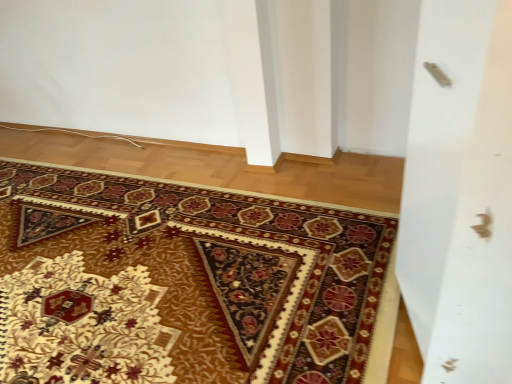
Question: Is carpet with intricate patterns at center taller than silver metallic screen door at upper right?

Choices:
 (A) no
 (B) yes

Answer: (A)

Question: Is carpet with intricate patterns at center to the right of silver metallic screen door at upper right from the viewer's perspective?

Choices:
 (A) yes
 (B) no

Answer: (B)

Question: Is the depth of carpet with intricate patterns at center greater than that of silver metallic screen door at upper right?

Choices:
 (A) yes
 (B) no

Answer: (A)

Question: From the image's perspective, is carpet with intricate patterns at center over silver metallic screen door at upper right?

Choices:
 (A) no
 (B) yes

Answer: (A)

Question: Is carpet with intricate patterns at center bigger than silver metallic screen door at upper right?

Choices:
 (A) no
 (B) yes

Answer: (A)

Question: Is silver metallic screen door at upper right surrounded by carpet with intricate patterns at center?

Choices:
 (A) yes
 (B) no

Answer: (B)

Question: Is silver metallic screen door at upper right outside of carpet with intricate patterns at center?

Choices:
 (A) no
 (B) yes

Answer: (B)

Question: Is silver metallic screen door at upper right shorter than carpet with intricate patterns at center?

Choices:
 (A) no
 (B) yes

Answer: (A)

Question: Is the position of silver metallic screen door at upper right more distant than that of carpet with intricate patterns at center?

Choices:
 (A) yes
 (B) no

Answer: (B)

Question: Considering the relative sizes of silver metallic screen door at upper right and carpet with intricate patterns at center in the image provided, is silver metallic screen door at upper right thinner than carpet with intricate patterns at center?

Choices:
 (A) no
 (B) yes

Answer: (B)

Question: From a real-world perspective, is silver metallic screen door at upper right below carpet with intricate patterns at center?

Choices:
 (A) no
 (B) yes

Answer: (A)

Question: Is silver metallic screen door at upper right oriented towards carpet with intricate patterns at center?

Choices:
 (A) no
 (B) yes

Answer: (B)

Question: Is carpet with intricate patterns at center taller or shorter than silver metallic screen door at upper right?

Choices:
 (A) short
 (B) tall

Answer: (A)